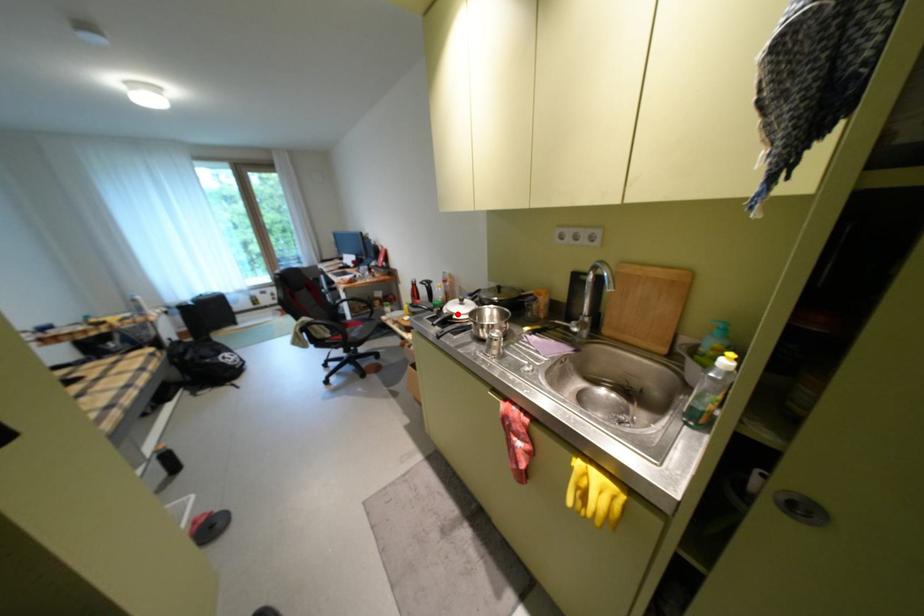
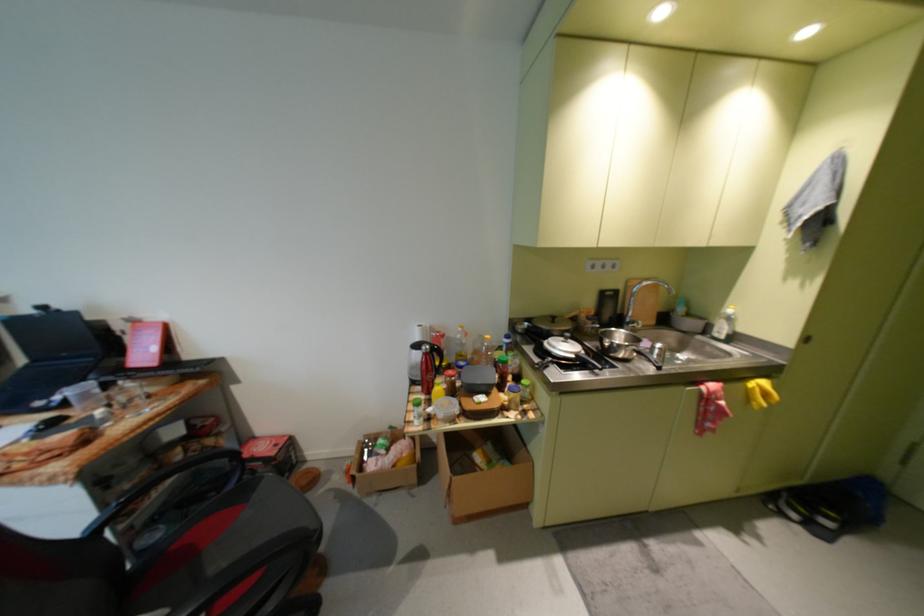
In the second image, find the point that corresponds to the highlighted location in the first image.

(586, 357)